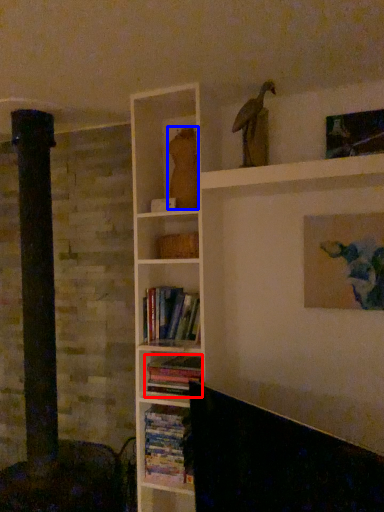
Question: Which point is further to the camera, book (highlighted by a red box) or animal (highlighted by a blue box)?

Choices:
 (A) book
 (B) animal

Answer: (B)